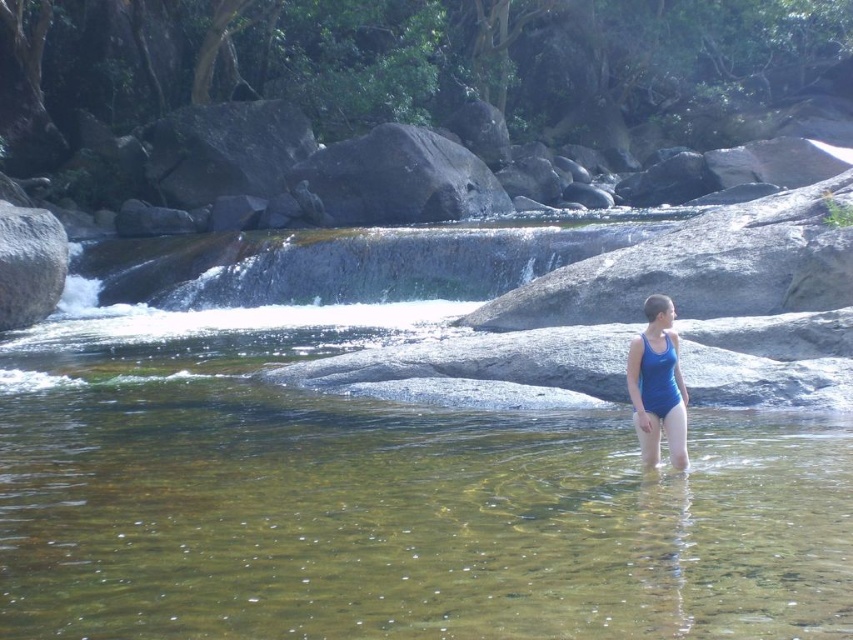
What do you see at coordinates (657, 385) in the screenshot?
I see `blue fabric swimsuit at center` at bounding box center [657, 385].

Who is lower down, blue fabric swimsuit at center or gray smooth rock at left?

blue fabric swimsuit at center is lower down.

Is point (653, 340) farther from viewer compared to point (3, 216)?

That is False.

Where is `blue fabric swimsuit at center`? The height and width of the screenshot is (640, 853). blue fabric swimsuit at center is located at coordinates (657, 385).

Does gray rough rock at center have a larger size compared to gray smooth rock at left?

Yes.

How far apart are gray rough rock at center and gray smooth rock at left?

gray rough rock at center is 78.68 feet away from gray smooth rock at left.

Where is `gray rough rock at center`? gray rough rock at center is located at coordinates coord(399,179).

Who is more forward, (405,176) or (668,381)?

Point (668,381) is in front.

Find the location of `gray rough rock at center`. gray rough rock at center is located at coordinates (399, 179).